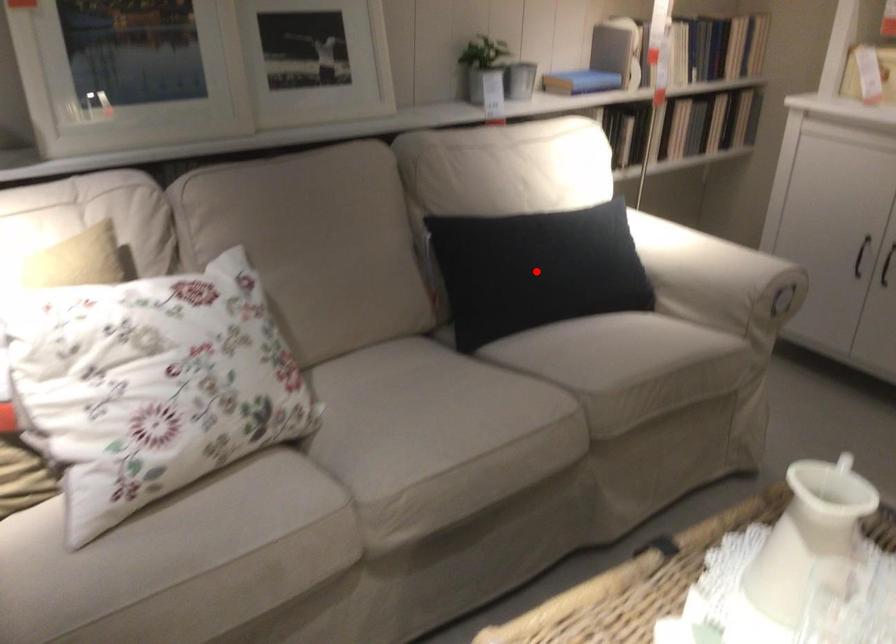
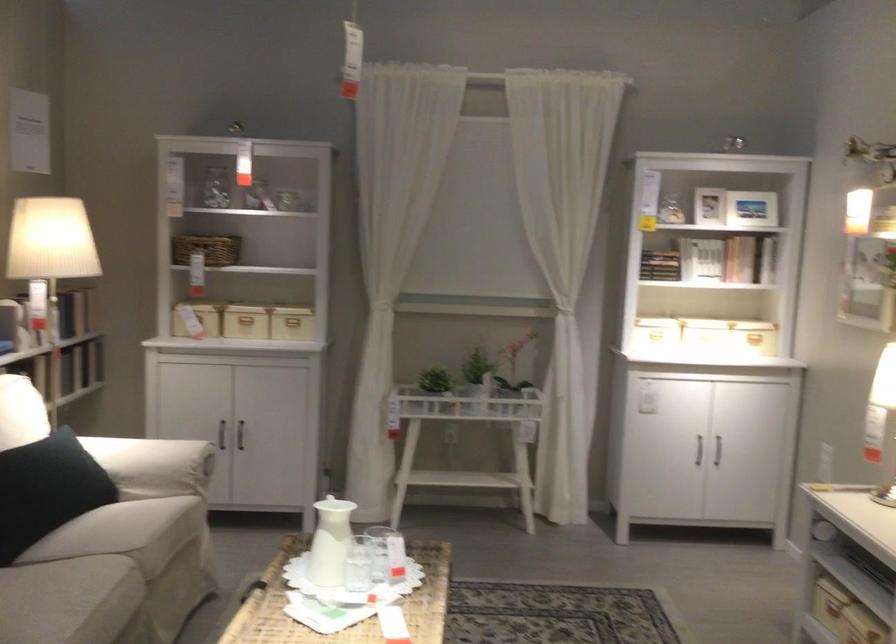
Locate, in the second image, the point that corresponds to the highlighted location in the first image.

(47, 489)